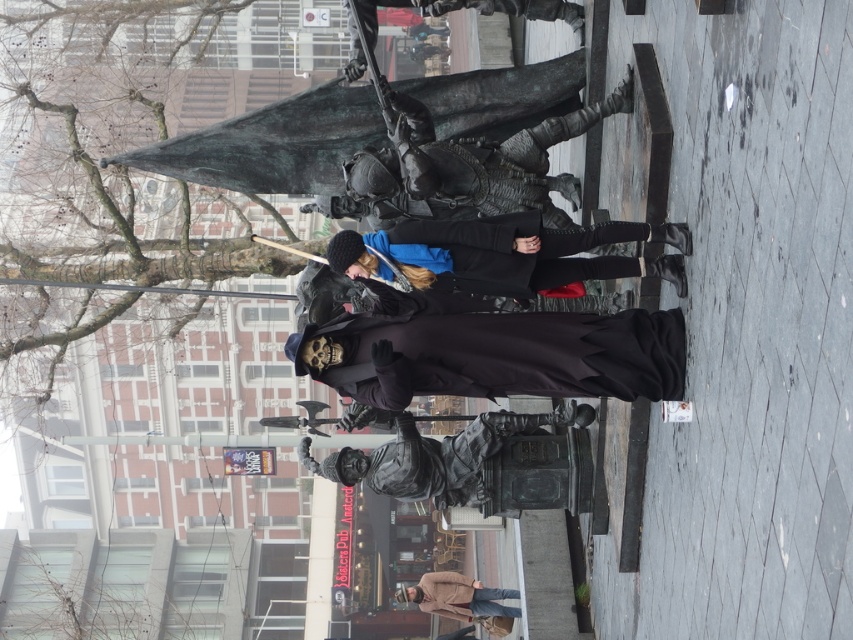
Who is higher up, gray concrete pavement at lower right or beige wool coat at lower center?

gray concrete pavement at lower right is higher up.

Between gray concrete pavement at lower right and beige wool coat at lower center, which one has more height?

With more height is beige wool coat at lower center.

Does point (543, 563) lie in front of point (436, 608)?

That is True.

Image resolution: width=853 pixels, height=640 pixels. I want to click on gray concrete pavement at lower right, so click(x=544, y=576).

Is bronze statue at center smaller than gray concrete pavement at lower right?

Incorrect, bronze statue at center is not smaller in size than gray concrete pavement at lower right.

The image size is (853, 640). What do you see at coordinates (457, 460) in the screenshot?
I see `bronze statue at center` at bounding box center [457, 460].

Where is `bronze statue at center`? Image resolution: width=853 pixels, height=640 pixels. bronze statue at center is located at coordinates (457, 460).

Where is `bronze statue at center`? The height and width of the screenshot is (640, 853). bronze statue at center is located at coordinates (457, 460).

Who is positioned more to the left, black matte coat at center or shiny black armor at upper center?

Positioned to the left is shiny black armor at upper center.

In the scene shown: Can you confirm if black matte coat at center is taller than shiny black armor at upper center?

Incorrect, black matte coat at center's height is not larger of shiny black armor at upper center's.

Describe the element at coordinates (506, 253) in the screenshot. I see `black matte coat at center` at that location.

The width and height of the screenshot is (853, 640). I want to click on black matte coat at center, so click(506, 253).